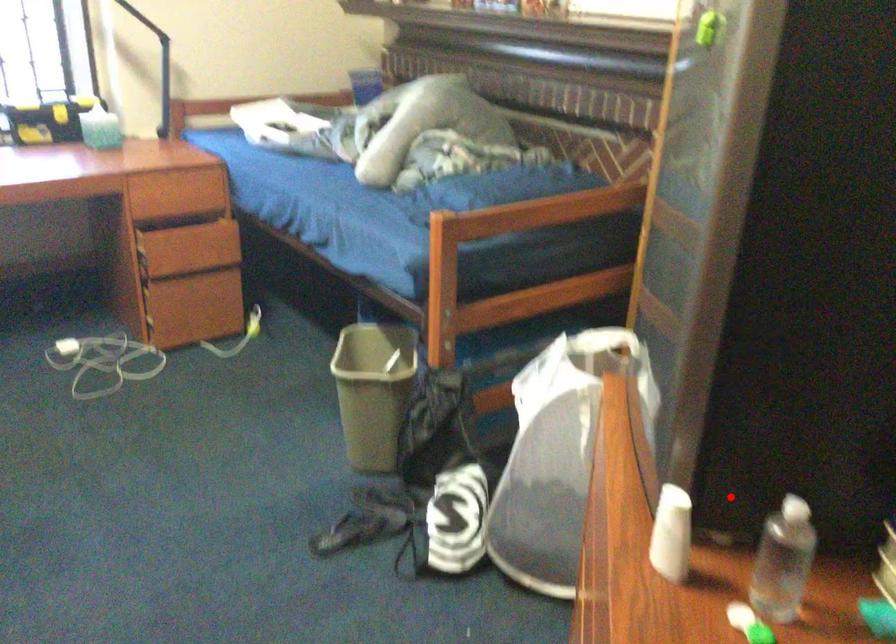
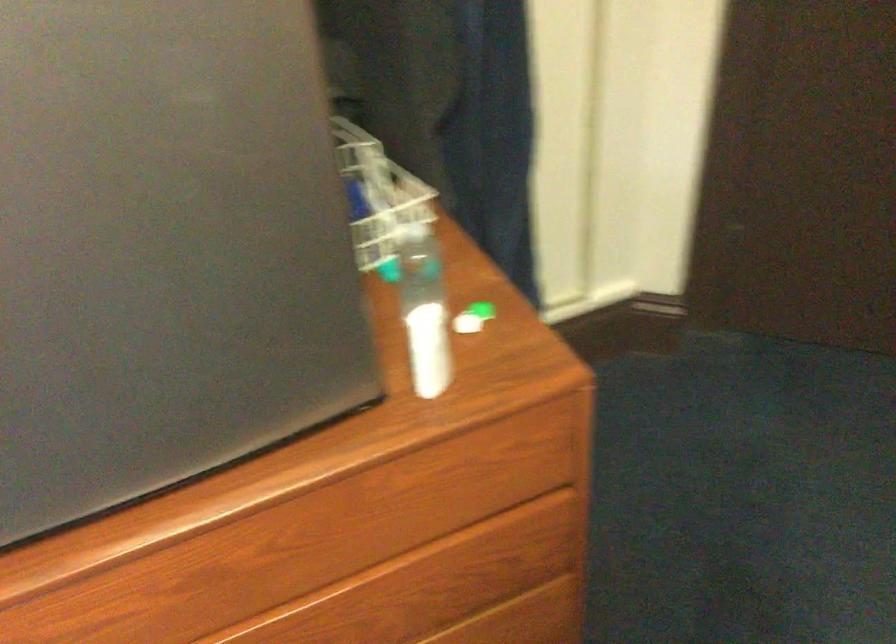
Question: I am providing you with two images of the same scene from different viewpoints. In image1, a red point is highlighted. Considering the same 3D point in image2, which of the following is correct?

Choices:
 (A) It is closer
 (B) It is farther

Answer: (A)